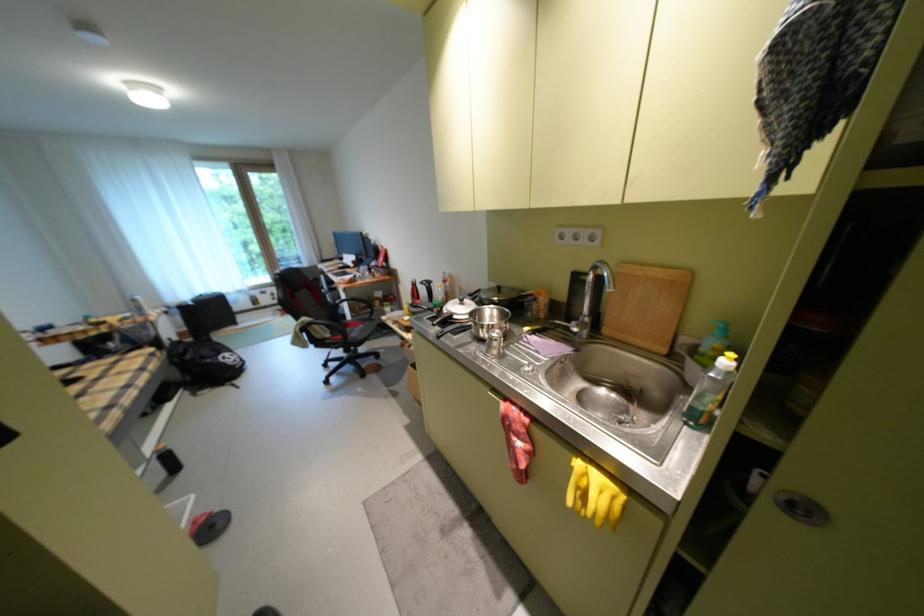
In order to click on clear plastic bottle in this screenshot , I will do `click(710, 391)`.